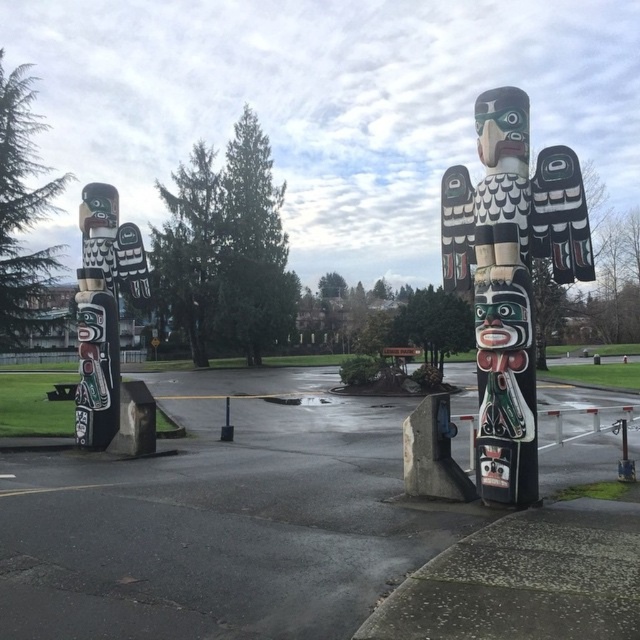
Question: Which of the following is the closest to the observer?

Choices:
 (A) (524, 483)
 (B) (129, 225)

Answer: (A)

Question: Which of the following is the farthest from the observer?

Choices:
 (A) (492, 497)
 (B) (104, 250)

Answer: (B)

Question: Which object is closer to the camera taking this photo?

Choices:
 (A) smooth asphalt parking lot at center
 (B) polished wood totem pole at left

Answer: (A)

Question: Does smooth asphalt parking lot at center have a lesser width compared to black painted wood totem pole at right?

Choices:
 (A) yes
 (B) no

Answer: (B)

Question: Is black painted wood totem pole at right smaller than polished wood totem pole at left?

Choices:
 (A) yes
 (B) no

Answer: (A)

Question: Does black painted wood totem pole at right appear over polished wood totem pole at left?

Choices:
 (A) no
 (B) yes

Answer: (A)